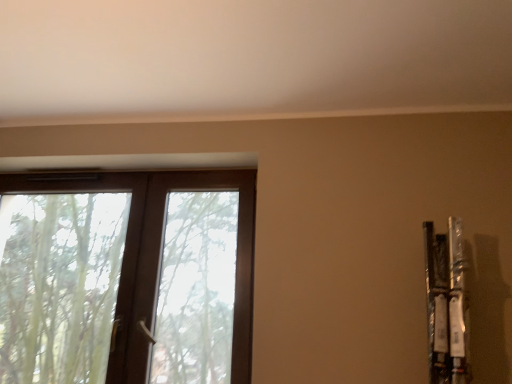
Locate an element on the screen. This screenshot has width=512, height=384. brown wooden window at left is located at coordinates (161, 243).

Describe the element at coordinates (161, 243) in the screenshot. I see `brown wooden window at left` at that location.

This screenshot has height=384, width=512. Identify the location of brown wooden window at left. (161, 243).